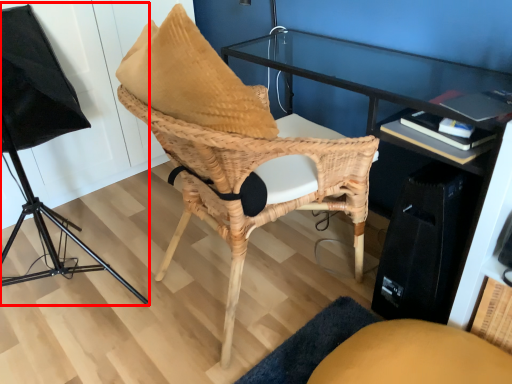
Question: From the image's perspective, where is lamp (annotated by the red box) located in relation to chair in the image?

Choices:
 (A) above
 (B) below

Answer: (A)